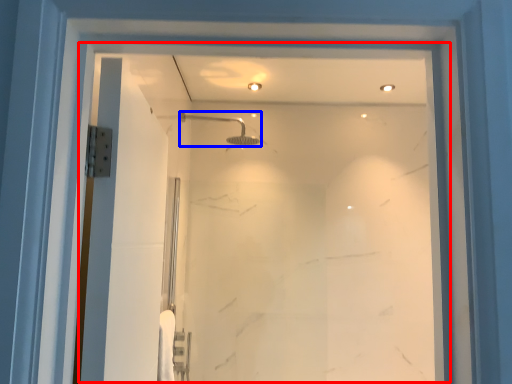
Question: Which object appears closest to the camera in this image, glass door (highlighted by a red box) or shower (highlighted by a blue box)?

Choices:
 (A) glass door
 (B) shower

Answer: (A)